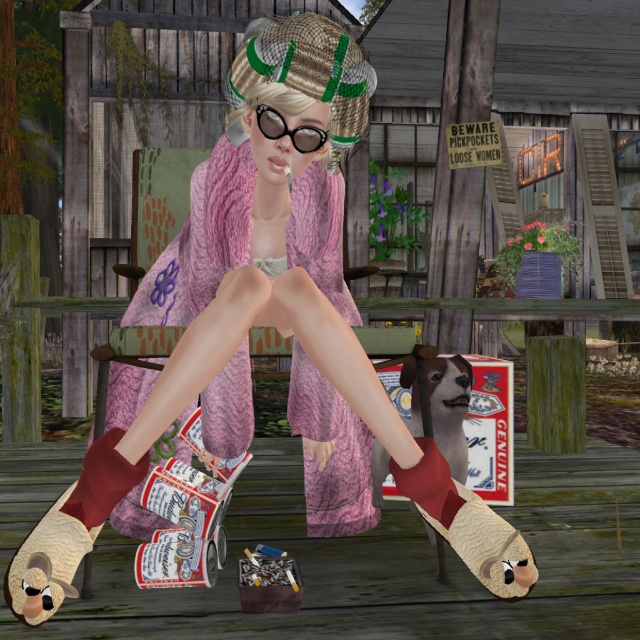
You are a fashion designer who wants to create a matching accessory for the pink knitted dress at center and the burgundy knitted sock at lower left. Based on their positions, how far apart should the accessories be placed?

The pink knitted dress at center is 22.25 inches away from the burgundy knitted sock at lower left, so the accessories should be placed 22.25 inches apart to match their positions.